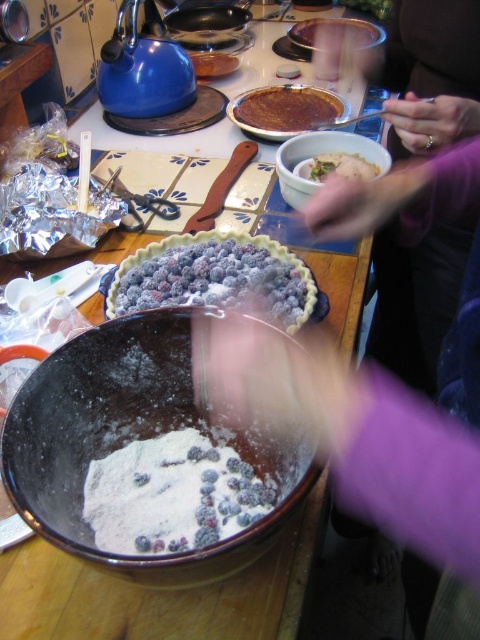
Question: Which object is closer to the camera taking this photo?

Choices:
 (A) blueberry pie crust at center
 (B) brown matte pie at center
 (C) white powdery blueberries at center

Answer: (C)

Question: Does brown matte pie at center appear under green leafy vegetable at upper center?

Choices:
 (A) yes
 (B) no

Answer: (B)

Question: Does blueberry pie crust at center have a smaller size compared to brown matte pie at center?

Choices:
 (A) no
 (B) yes

Answer: (B)

Question: Can you confirm if blueberry pie crust at center is positioned below green leafy vegetable at upper center?

Choices:
 (A) yes
 (B) no

Answer: (A)

Question: Considering the real-world distances, which object is farthest from the brown matte pie at center?

Choices:
 (A) white powdery blueberries at center
 (B) green leafy vegetable at upper center
 (C) blueberry pie crust at center

Answer: (A)

Question: Which point is closer to the camera?

Choices:
 (A) brown crumbly pie crust at center
 (B) brown matte pie at center
 (C) white powdery blueberries at center
 (D) blueberry pie crust at center

Answer: (C)